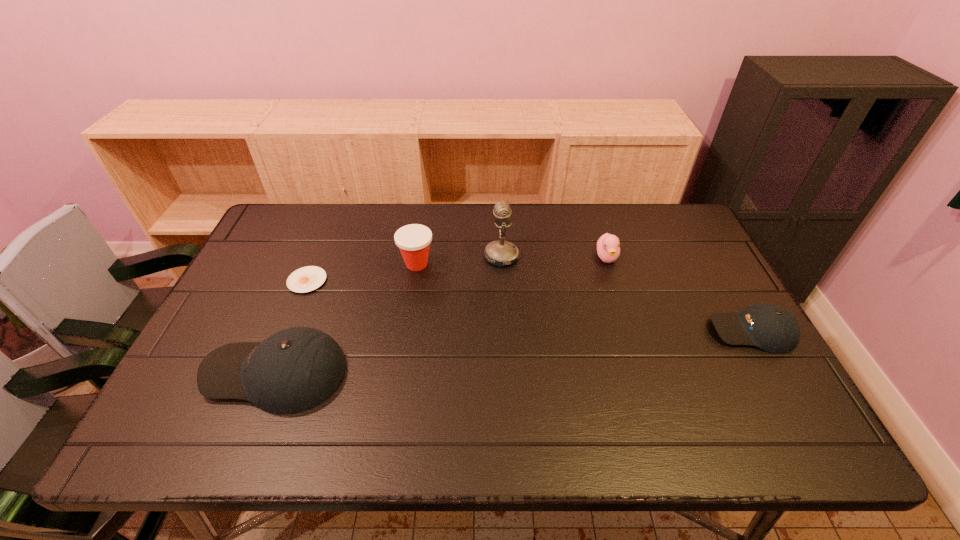
Locate an element on the screen. Image resolution: width=960 pixels, height=540 pixels. free region located 0.260m on the front-facing side of the rightmost object is located at coordinates (611, 331).

The width and height of the screenshot is (960, 540). Identify the location of vacant space located on the front-facing side of the rightmost object. pyautogui.click(x=622, y=331).

You are a GUI agent. You are given a task and a screenshot of the screen. Output one action in this format:
    pyautogui.click(x=<x>, y=<y>)
    Task: Click on the free region located on the front-facing side of the rightmost object
    This screenshot has width=960, height=540.
    Given the screenshot: What is the action you would take?
    pyautogui.click(x=595, y=331)

Where is `vacant space located on the front-facing side of the duckling`? vacant space located on the front-facing side of the duckling is located at coordinates (627, 324).

Locate an element on the screen. vacant area located 0.060m on the back of the egg yolk is located at coordinates pos(318,255).

Find the location of a particular element. This screenshot has height=540, width=960. blank space located on the front-facing side of the microphone is located at coordinates (417, 256).

The height and width of the screenshot is (540, 960). Find the location of `vacant space located on the front-facing side of the microphone`. vacant space located on the front-facing side of the microphone is located at coordinates (423, 256).

Where is `free spot located 0.090m on the front-facing side of the microphone`? free spot located 0.090m on the front-facing side of the microphone is located at coordinates (455, 256).

What are the coordinates of `vacant space situated 0.120m on the front of the Dixie cup` in the screenshot? It's located at (410, 306).

You are a GUI agent. You are given a task and a screenshot of the screen. Output one action in this format:
    pyautogui.click(x=<x>, y=<y>)
    Task: Click on the duckling situated at the far edge
    The height and width of the screenshot is (540, 960).
    Given the screenshot: What is the action you would take?
    pyautogui.click(x=608, y=249)